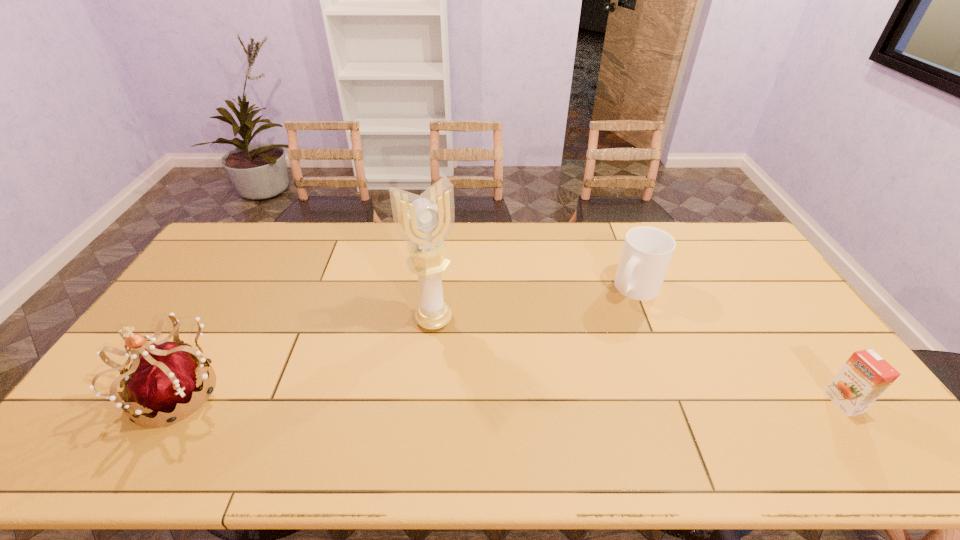
Identify the location of object that is at the near right corner. The height and width of the screenshot is (540, 960). (866, 375).

Find the location of a particular element. free point at the far edge is located at coordinates (254, 256).

Locate an element on the screen. The height and width of the screenshot is (540, 960). vacant region at the near edge of the desktop is located at coordinates (707, 414).

Find the location of a particular element. free spot at the right edge of the desktop is located at coordinates (775, 349).

Where is `blank space at the far right corner of the desktop`? blank space at the far right corner of the desktop is located at coordinates (718, 249).

You are a GUI agent. You are given a task and a screenshot of the screen. Output one action in this format:
    pyautogui.click(x=<x>, y=<y>)
    Task: Click on the vacant point located between the second tallest object and the tallest object
    The width and height of the screenshot is (960, 540).
    Given the screenshot: What is the action you would take?
    pyautogui.click(x=306, y=356)

You are a GUI agent. You are given a task and a screenshot of the screen. Output one action in this format:
    pyautogui.click(x=<x>, y=<y>)
    Task: Click on the empty space that is in between the tiara and the orange juice
    
    Given the screenshot: What is the action you would take?
    pyautogui.click(x=511, y=397)

Where is `vacant area between the tiara and the third tallest object`? This screenshot has height=540, width=960. vacant area between the tiara and the third tallest object is located at coordinates (407, 340).

The image size is (960, 540). I want to click on free space between the second shortest object and the rightmost object, so click(x=738, y=345).

Locate an element on the screen. The image size is (960, 540). vacant point located between the tiara and the rightmost object is located at coordinates (511, 397).